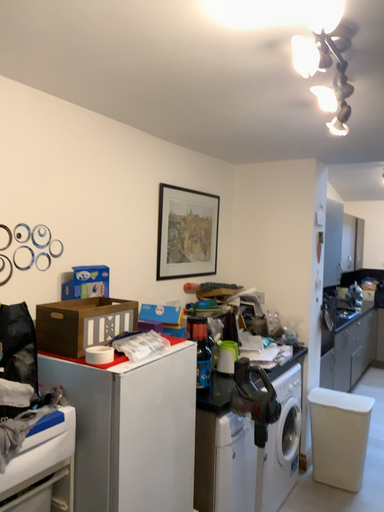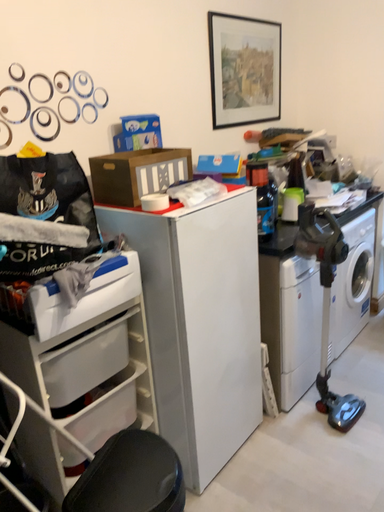
Question: Which way did the camera rotate in the video?

Choices:
 (A) rotated left
 (B) rotated right

Answer: (A)